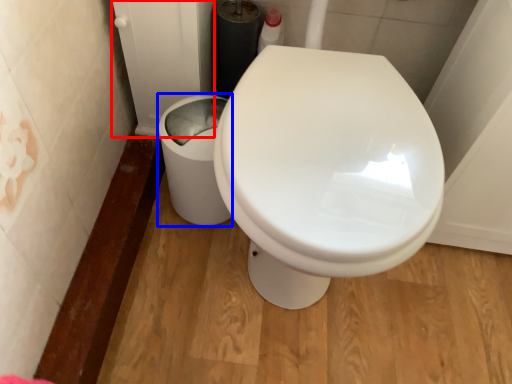
Question: Which object is closer to the camera taking this photo, screen door (highlighted by a red box) or porcelain (highlighted by a blue box)?

Choices:
 (A) screen door
 (B) porcelain

Answer: (A)